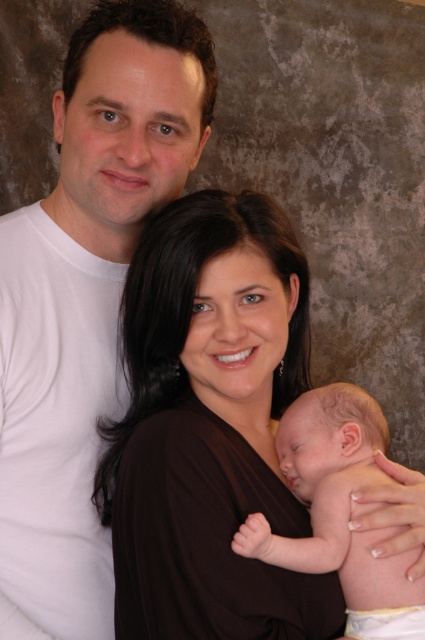
Is brown matte dress at center bigger than smooth skin baby at center?

Indeed, brown matte dress at center has a larger size compared to smooth skin baby at center.

Locate an element on the screen. brown matte dress at center is located at coordinates (209, 428).

Which of these two, brown matte dress at center or white matte t-shirt at upper left, stands taller?

white matte t-shirt at upper left

Who is higher up, brown matte dress at center or white matte t-shirt at upper left?

Positioned higher is white matte t-shirt at upper left.

Is point (283, 634) closer to camera compared to point (34, 326)?

Yes, it is in front of point (34, 326).

In order to click on brown matte dress at center in this screenshot , I will do `click(209, 428)`.

In the scene shown: Is the position of white matte t-shirt at upper left less distant than that of smooth skin baby at center?

No, white matte t-shirt at upper left is further to the viewer.

Does white matte t-shirt at upper left appear on the right side of smooth skin baby at center?

No, white matte t-shirt at upper left is not to the right of smooth skin baby at center.

Who is more distant from viewer, (3, 458) or (311, 412)?

Point (311, 412)

Find the location of a particular element. white matte t-shirt at upper left is located at coordinates (85, 298).